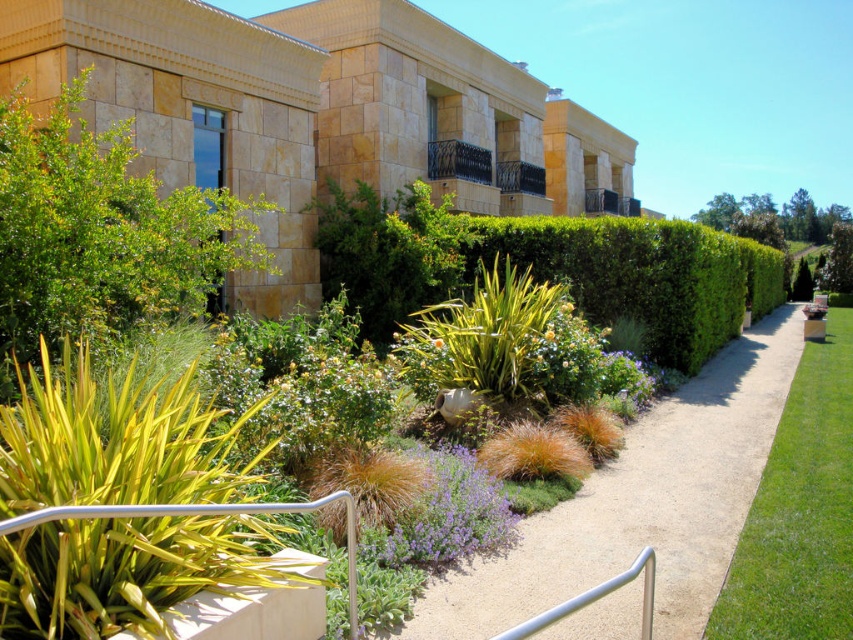
Question: Estimate the real-world distances between objects in this image. Which object is farther from the purple soft-textured flower at center?

Choices:
 (A) green leafy bush at upper left
 (B) smooth gravel path at center
 (C) green leafy hedge at center
 (D) yellow matte flower at center

Answer: (C)

Question: Which object is the closest to the green leafy hedge at center?

Choices:
 (A) purple soft-textured flower at center
 (B) smooth gravel path at center
 (C) yellow matte flower at center
 (D) green leafy bush at upper left

Answer: (B)

Question: Where is green leafy hedge at center located in relation to yellow matte flower at center in the image?

Choices:
 (A) above
 (B) below

Answer: (A)

Question: Does purple soft-textured flower at center have a smaller size compared to yellow matte flower at center?

Choices:
 (A) yes
 (B) no

Answer: (B)

Question: Among these points, which one is farthest from the camera?

Choices:
 (A) (618, 280)
 (B) (492, 604)
 (C) (442, 346)
 (D) (450, 451)

Answer: (A)

Question: Is green leafy hedge at center closer to camera compared to purple soft-textured flower at center?

Choices:
 (A) no
 (B) yes

Answer: (A)